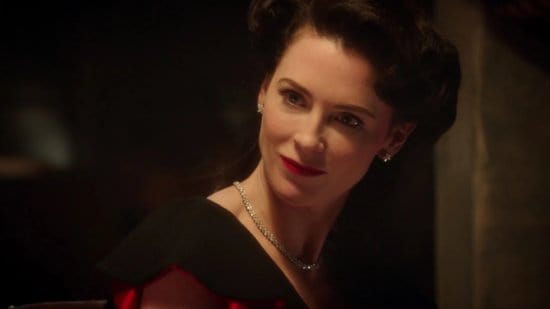
Locate an element on the screen. wall is located at coordinates (467, 201).